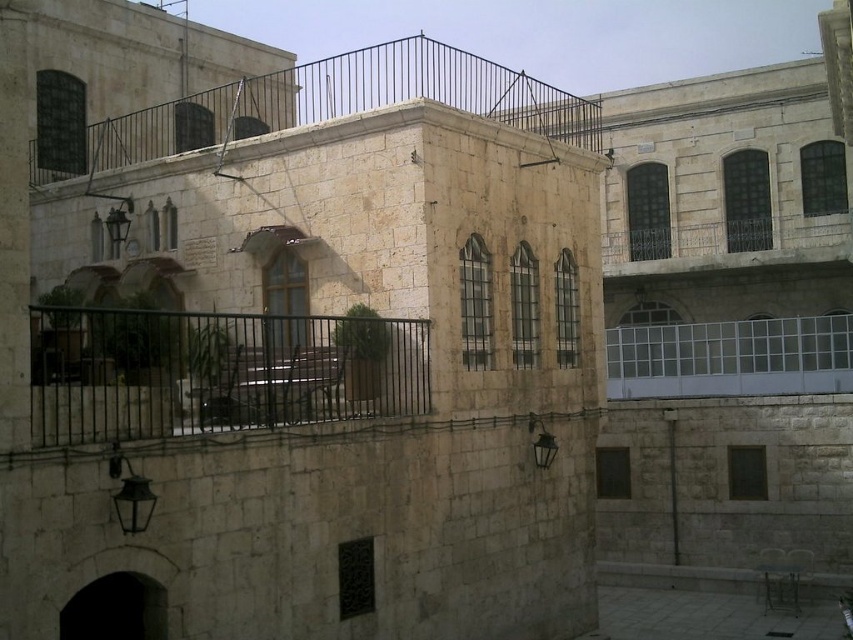
Between rustic stone balcony at upper center and clear glass balcony at center, which one has more height?

With more height is rustic stone balcony at upper center.

Can you confirm if rustic stone balcony at upper center is positioned above clear glass balcony at center?

Yes, rustic stone balcony at upper center is above clear glass balcony at center.

You are a GUI agent. You are given a task and a screenshot of the screen. Output one action in this format:
    pyautogui.click(x=<x>, y=<y>)
    Task: Click on the rustic stone balcony at upper center
    The width and height of the screenshot is (853, 640).
    Given the screenshot: What is the action you would take?
    pyautogui.click(x=323, y=106)

Who is higher up, black metal bench at center or rustic stone balcony at upper center?

rustic stone balcony at upper center is higher up.

Can you confirm if black metal bench at center is wider than rustic stone balcony at upper center?

In fact, black metal bench at center might be narrower than rustic stone balcony at upper center.

Locate an element on the screen. This screenshot has height=640, width=853. black metal bench at center is located at coordinates pyautogui.click(x=215, y=371).

Can you confirm if black metal bench at center is positioned to the right of clear glass balcony at center?

Incorrect, black metal bench at center is not on the right side of clear glass balcony at center.

Can you confirm if black metal bench at center is positioned above clear glass balcony at center?

Indeed, black metal bench at center is positioned over clear glass balcony at center.

Does point (264, 412) lie in front of point (755, 328)?

Yes, point (264, 412) is in front of point (755, 328).

Find the location of `black metal bench at center`. black metal bench at center is located at coordinates (215, 371).